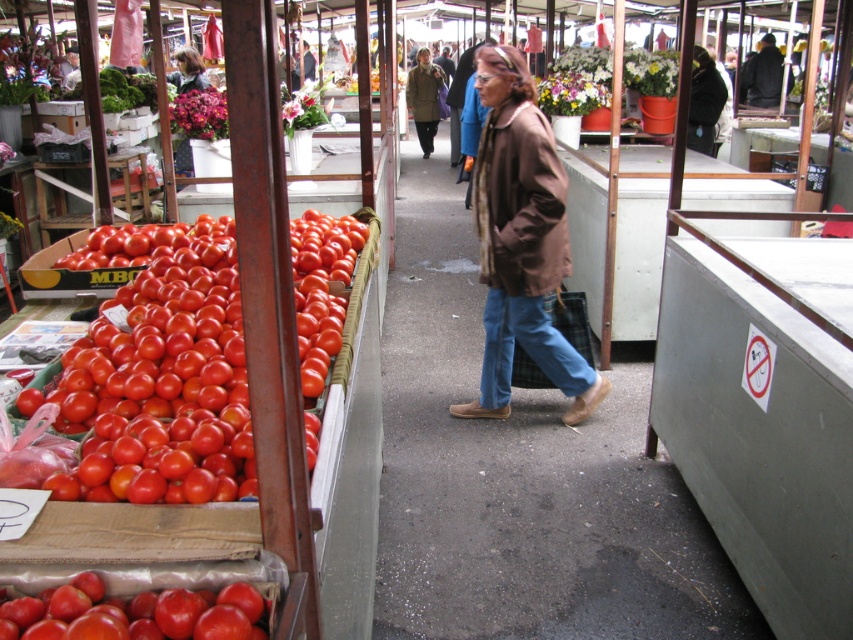
Question: Observing the image, what is the correct spatial positioning of brown textured trench coat at center in reference to dark brown leather jacket at upper right?

Choices:
 (A) below
 (B) above

Answer: (A)

Question: Is shiny red tomatoes at left bigger than glossy red tomato at left?

Choices:
 (A) yes
 (B) no

Answer: (A)

Question: Is glossy red tomato at left above dark brown leather jacket at upper right?

Choices:
 (A) no
 (B) yes

Answer: (A)

Question: Which of the following is the farthest from the observer?

Choices:
 (A) (38, 628)
 (B) (347, 358)
 (C) (604, 388)

Answer: (C)

Question: Which of the following is the closest to the observer?

Choices:
 (A) dark brown leather jacket at upper right
 (B) brown textured trench coat at center
 (C) glossy red tomato at left
 (D) brown leather jacket at center

Answer: (C)

Question: Which object appears closest to the camera in this image?

Choices:
 (A) dark brown leather jacket at upper right
 (B) brown leather jacket at center
 (C) brown textured trench coat at center

Answer: (B)